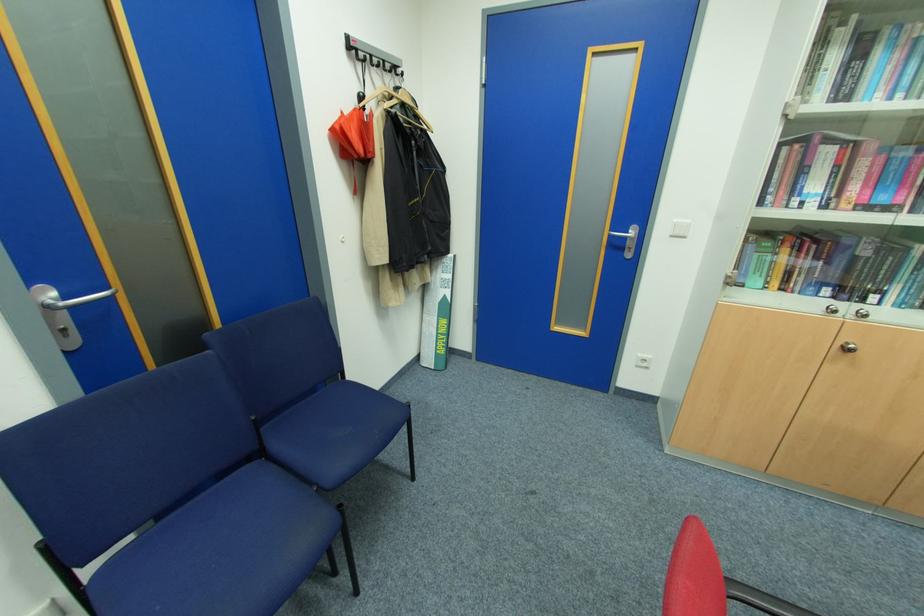
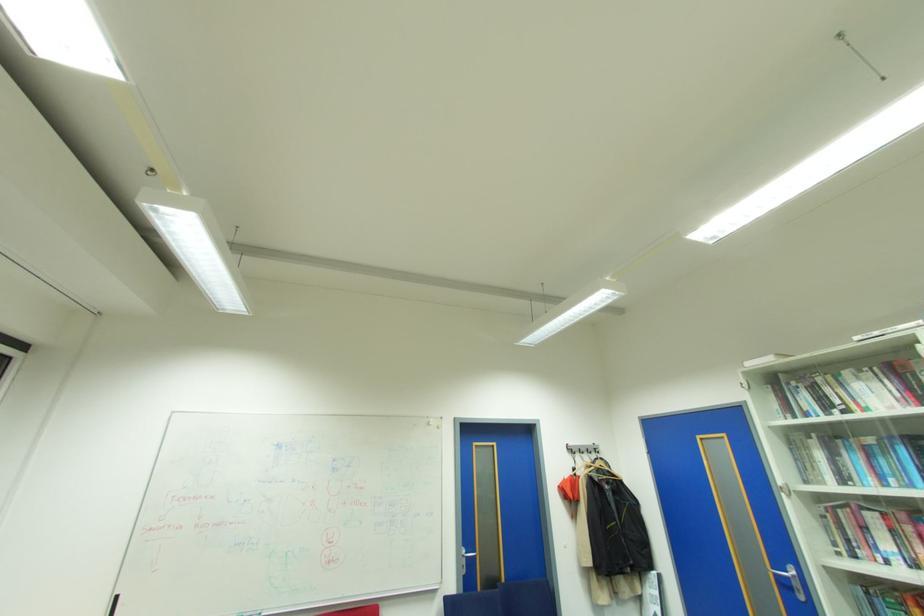
Locate, in the second image, the point that corresponds to point (58, 293) in the first image.

(468, 552)